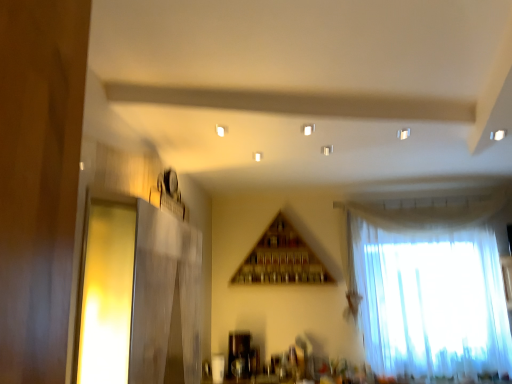
Question: From the image's perspective, does white sheer curtain at right appear higher than translucent glass window at left?

Choices:
 (A) no
 (B) yes

Answer: (A)

Question: Does white sheer curtain at right have a larger size compared to translucent glass window at left?

Choices:
 (A) no
 (B) yes

Answer: (B)

Question: Is white sheer curtain at right facing away from translucent glass window at left?

Choices:
 (A) no
 (B) yes

Answer: (A)

Question: Is white sheer curtain at right further to camera compared to translucent glass window at left?

Choices:
 (A) no
 (B) yes

Answer: (B)

Question: Does white sheer curtain at right have a greater height compared to translucent glass window at left?

Choices:
 (A) yes
 (B) no

Answer: (A)

Question: Is white sheer curtain at right positioned in front of translucent glass window at left?

Choices:
 (A) no
 (B) yes

Answer: (A)

Question: Can you confirm if translucent glass window at left is thinner than white sheer curtain at right?

Choices:
 (A) yes
 (B) no

Answer: (A)

Question: From a real-world perspective, is translucent glass window at left physically below white sheer curtain at right?

Choices:
 (A) yes
 (B) no

Answer: (A)

Question: Does translucent glass window at left lie in front of white sheer curtain at right?

Choices:
 (A) no
 (B) yes

Answer: (B)

Question: Is translucent glass window at left positioned behind white sheer curtain at right?

Choices:
 (A) yes
 (B) no

Answer: (B)

Question: Is translucent glass window at left positioned with its back to white sheer curtain at right?

Choices:
 (A) no
 (B) yes

Answer: (A)

Question: Does translucent glass window at left have a greater height compared to white sheer curtain at right?

Choices:
 (A) yes
 (B) no

Answer: (B)

Question: Is white sheer curtain at right taller or shorter than translucent glass window at left?

Choices:
 (A) short
 (B) tall

Answer: (B)